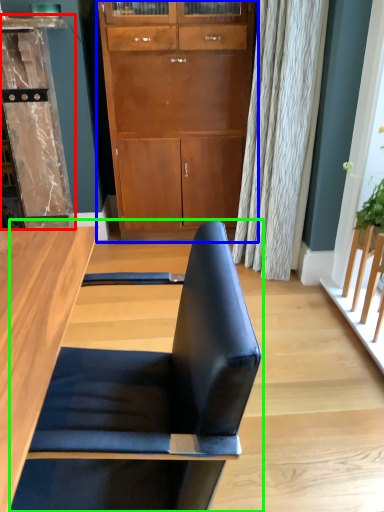
Question: Based on their relative distances, which object is nearer to dresser (highlighted by a red box)? Choose from cabinetry (highlighted by a blue box) and chair (highlighted by a green box).

Choices:
 (A) cabinetry
 (B) chair

Answer: (A)